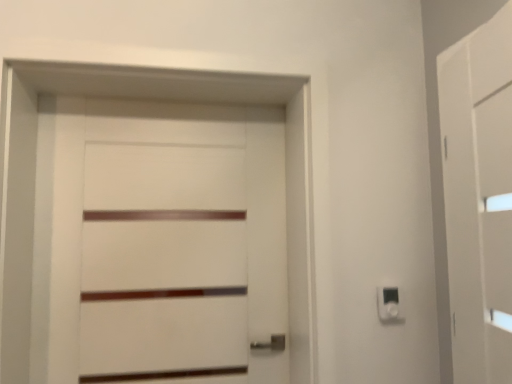
Where is `white plastic light switch at lower right`? white plastic light switch at lower right is located at coordinates (388, 303).

The width and height of the screenshot is (512, 384). I want to click on white matte barn door at right, so click(x=467, y=188).

Measure the distance from white matte barn door at right to white matte door at center.

white matte barn door at right and white matte door at center are 33.11 inches apart.

Is the surface of white matte barn door at right in direct contact with white matte door at center?

No, white matte barn door at right is not touching white matte door at center.

Locate an element on the screen. Image resolution: width=512 pixels, height=384 pixels. door located underneath the white matte barn door at right (from a real-world perspective) is located at coordinates (167, 242).

Which object is more forward, white matte barn door at right or white matte door at center?

white matte barn door at right is more forward.

Is white plastic light switch at lower right thinner than white matte door at center?

Yes, white plastic light switch at lower right is thinner than white matte door at center.

From the image's perspective, relative to white matte door at center, is white plastic light switch at lower right above or below?

From the image's perspective, white plastic light switch at lower right appears below white matte door at center.

Is white plastic light switch at lower right looking in the opposite direction of white matte door at center?

No, white plastic light switch at lower right's orientation is not away from white matte door at center.

Does white plastic light switch at lower right appear on the left side of white matte door at center?

No, white plastic light switch at lower right is not to the left of white matte door at center.

Does white matte door at center touch white plastic light switch at lower right?

No, white matte door at center is not with white plastic light switch at lower right.

Could you tell me if white matte door at center is facing white plastic light switch at lower right?

No, white matte door at center does not turn towards white plastic light switch at lower right.

Is white matte door at center bigger or smaller than white plastic light switch at lower right?

In the image, white matte door at center appears to be larger than white plastic light switch at lower right.

From a real-world perspective, which is physically above, white matte door at center or white plastic light switch at lower right?

white matte door at center.

From the image's perspective, is white plastic light switch at lower right positioned above or below white matte barn door at right?

white plastic light switch at lower right is situated lower than white matte barn door at right in the image.

Considering the sizes of white plastic light switch at lower right and white matte barn door at right in the image, is white plastic light switch at lower right wider or thinner than white matte barn door at right?

In the image, white plastic light switch at lower right appears to be more narrow than white matte barn door at right.

Does white plastic light switch at lower right turn towards white matte barn door at right?

Yes, white plastic light switch at lower right is aimed at white matte barn door at right.

I want to click on barn door in front of the white plastic light switch at lower right, so click(x=467, y=188).

Considering the relative sizes of white matte door at center and white matte barn door at right in the image provided, is white matte door at center taller than white matte barn door at right?

Yes, white matte door at center is taller than white matte barn door at right.

Which is nearer, [253,189] or [472,108]?

Point [253,189] appears to be farther away from the viewer than point [472,108].

Would you say white matte barn door at right is part of white matte door at center's contents?

No.

From the picture: Does white matte door at center turn towards white matte barn door at right?

No, white matte door at center is not turned towards white matte barn door at right.

Does white matte barn door at right touch white plastic light switch at lower right?

No, white matte barn door at right is not touching white plastic light switch at lower right.

Is point (449, 282) positioned behind point (384, 309)?

Yes, point (449, 282) is behind point (384, 309).

Considering the relative positions of white matte barn door at right and white plastic light switch at lower right in the image provided, is white matte barn door at right to the left of white plastic light switch at lower right from the viewer's perspective?

In fact, white matte barn door at right is to the right of white plastic light switch at lower right.

From the image's perspective, relative to white plastic light switch at lower right, is white matte barn door at right above or below?

Based on their image positions, white matte barn door at right is located above white plastic light switch at lower right.

Where is `barn door that appears above the white matte door at center (from a real-world perspective)`? The width and height of the screenshot is (512, 384). barn door that appears above the white matte door at center (from a real-world perspective) is located at coordinates (467, 188).

Identify the location of door above the white plastic light switch at lower right (from the image's perspective). The width and height of the screenshot is (512, 384). (167, 242).

Based on the photo, which object lies further to the anchor point white plastic light switch at lower right, white matte door at center or white matte barn door at right?

white matte door at center.

Considering their positions, is white matte door at center positioned closer to white matte barn door at right than white plastic light switch at lower right?

Among the two, white plastic light switch at lower right is located nearer to white matte barn door at right.

Estimate the real-world distances between objects in this image. Which object is closer to white plastic light switch at lower right, white matte barn door at right or white matte door at center?

white matte barn door at right is positioned closer to the anchor white plastic light switch at lower right.

Estimate the real-world distances between objects in this image. Which object is closer to white matte door at center, white plastic light switch at lower right or white matte barn door at right?

Based on the image, white plastic light switch at lower right appears to be nearer to white matte door at center.

Based on their spatial positions, is white matte barn door at right or white plastic light switch at lower right further from white matte door at center?

The object further to white matte door at center is white matte barn door at right.

Considering their positions, is white plastic light switch at lower right positioned further to white matte barn door at right than white matte door at center?

Among the two, white matte door at center is located further to white matte barn door at right.

Find the location of a particular element. The width and height of the screenshot is (512, 384). light switch positioned between white matte barn door at right and white matte door at center from near to far is located at coordinates (388, 303).